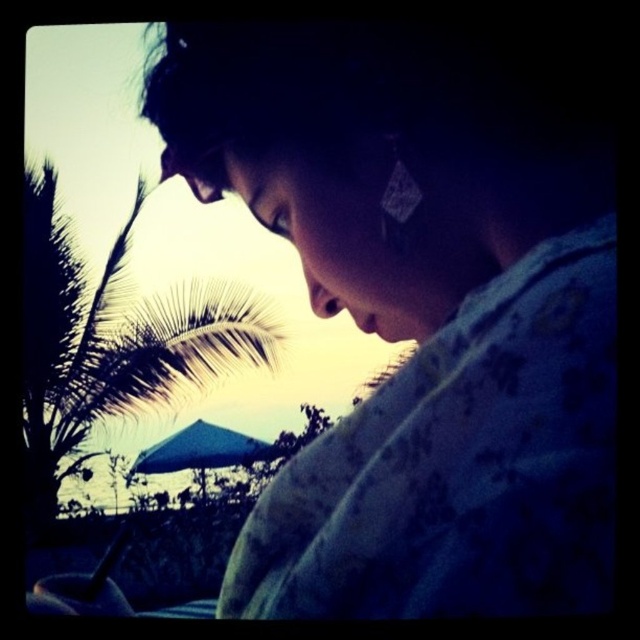
You are a photographer trying to capture the person in the matte floral shirt at center and the silvery leafy palm tree at upper left in the same frame. Based on their heights, which one will appear taller in the photo?

The silvery leafy palm tree at upper left appears taller in the photo because the matte floral shirt at center is not as tall as it.